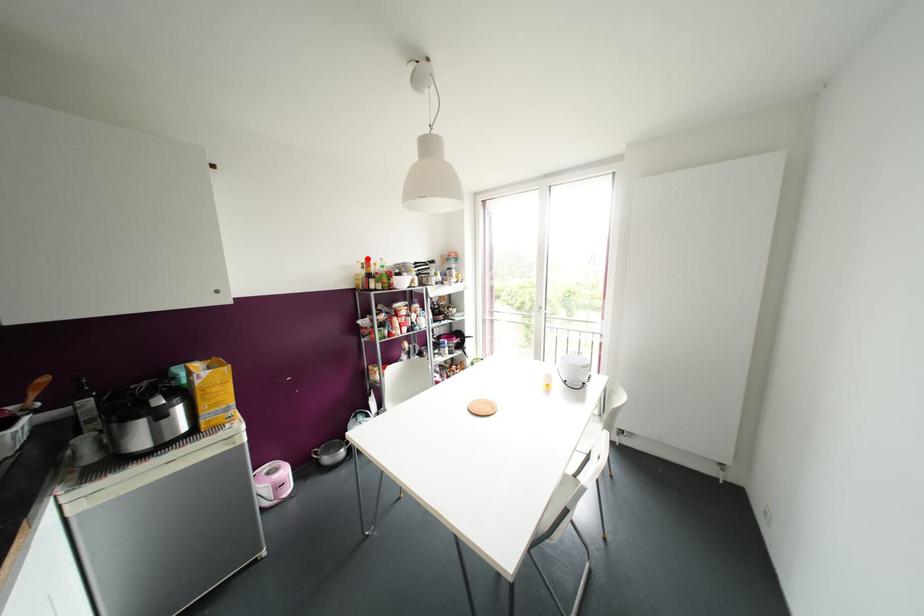
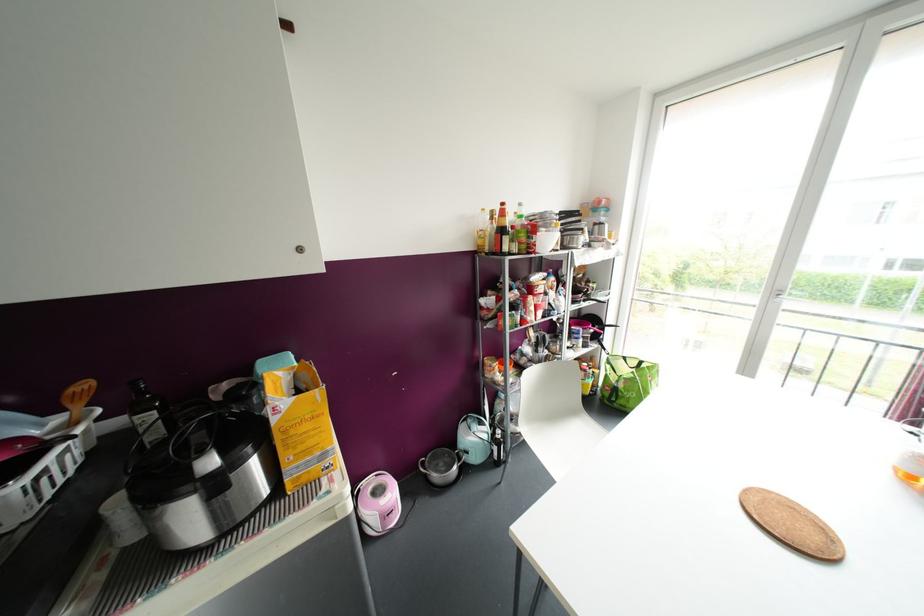
The point at the highlighted location is marked in the first image. Where is the corresponding point in the second image?

(502, 204)